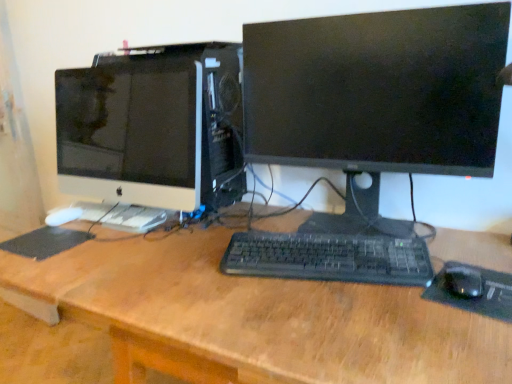
Locate an element on the screen. This screenshot has height=384, width=512. free space in front of black matte mousepad at lower left, which appears as the second mousepad when viewed from the front is located at coordinates (38, 266).